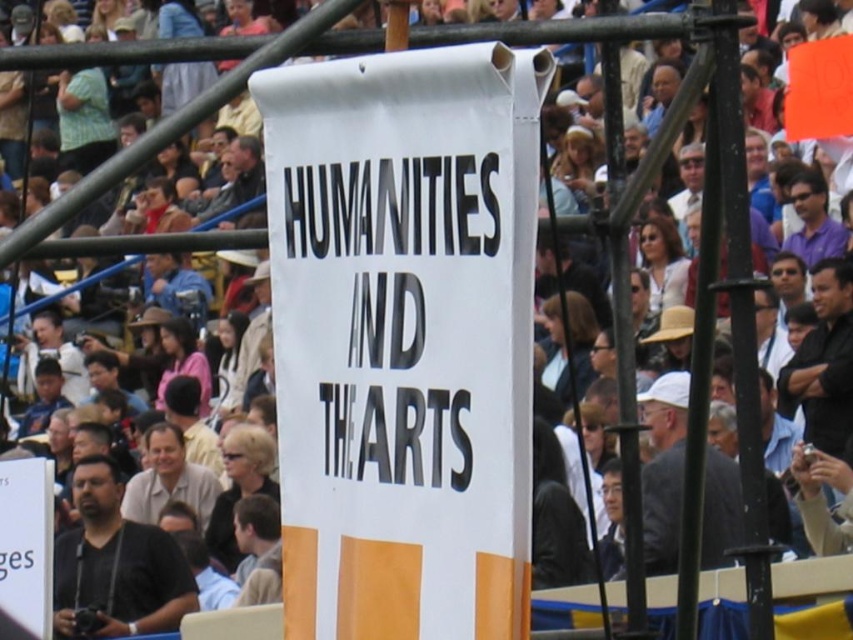
Question: Is matte black camera at lower left smaller than black leather jacket at right?

Choices:
 (A) no
 (B) yes

Answer: (A)

Question: Is matte black camera at lower left behind dark gray suit at center?

Choices:
 (A) no
 (B) yes

Answer: (B)

Question: Which point is farther to the camera?

Choices:
 (A) black leather jacket at right
 (B) dark gray suit at center

Answer: (A)

Question: Observing the image, what is the correct spatial positioning of white paper banner at center in reference to matte black camera at lower left?

Choices:
 (A) above
 (B) below

Answer: (A)

Question: Which of the following is the farthest from the observer?

Choices:
 (A) coord(821,326)
 (B) coord(674,435)
 (C) coord(357,195)
 (D) coord(84,616)

Answer: (D)

Question: Which object is farther from the camera taking this photo?

Choices:
 (A) black leather jacket at right
 (B) dark gray suit at center
 (C) matte black camera at lower left

Answer: (A)